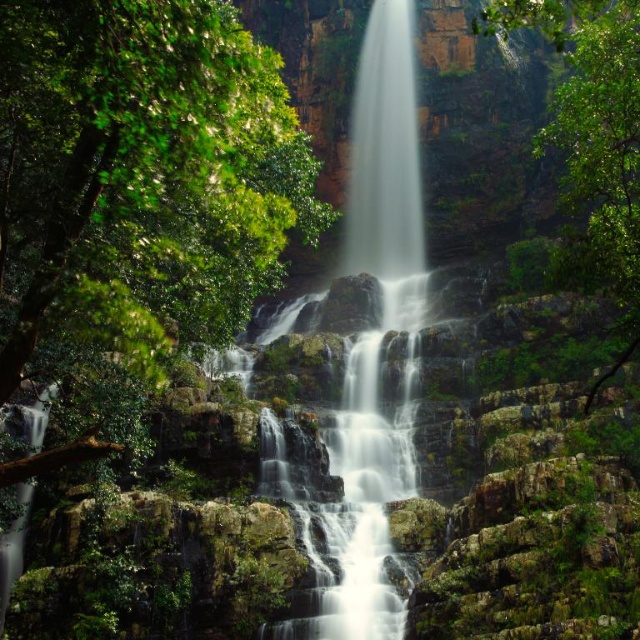
Locate an element on the screen. The height and width of the screenshot is (640, 640). green leafy tree at upper left is located at coordinates (136, 192).

This screenshot has width=640, height=640. Find the location of `green leafy tree at upper left`. green leafy tree at upper left is located at coordinates (136, 192).

Is white smooth waterfall at center further to camera compared to green leafy tree at right?

Yes, it is behind green leafy tree at right.

Does white smooth waterfall at center appear over green leafy tree at right?

Incorrect, white smooth waterfall at center is not positioned above green leafy tree at right.

This screenshot has height=640, width=640. What do you see at coordinates (369, 349) in the screenshot?
I see `white smooth waterfall at center` at bounding box center [369, 349].

Identify the location of white smooth waterfall at center. Image resolution: width=640 pixels, height=640 pixels. (369, 349).

Describe the element at coordinates (136, 192) in the screenshot. The image size is (640, 640). I see `green leafy tree at upper left` at that location.

Measure the distance between point (212, 253) and camera.

Point (212, 253) and camera are 42.44 meters apart.

Between point (138, 364) and point (596, 182), which one is positioned behind?

The point (138, 364) is more distant.

At what (x,y) coordinates should I click in order to perform the action: click on green leafy tree at upper left. Please return your answer as a coordinate pair (x, y). This screenshot has height=640, width=640. Looking at the image, I should click on (136, 192).